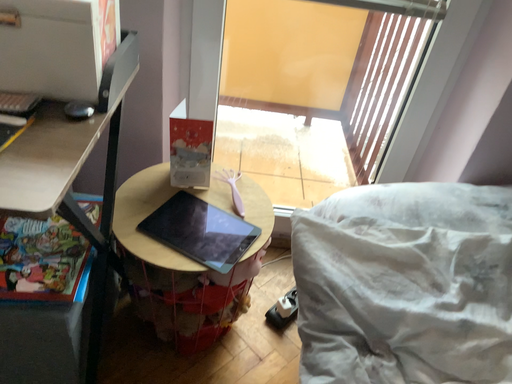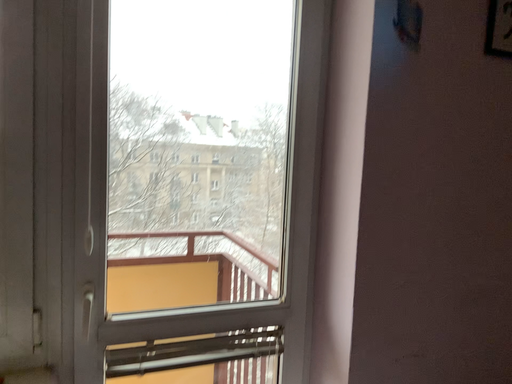
Question: Which way did the camera rotate in the video?

Choices:
 (A) rotated upward
 (B) rotated downward

Answer: (A)